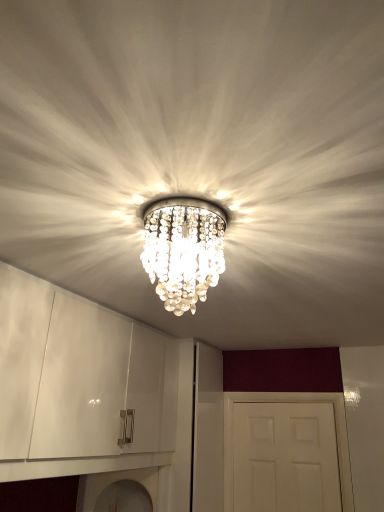
What do you see at coordinates (183, 249) in the screenshot? I see `clear crystal chandelier at center` at bounding box center [183, 249].

Find the location of `clear crystal chandelier at center`. clear crystal chandelier at center is located at coordinates (183, 249).

Describe the element at coordinates (285, 457) in the screenshot. The height and width of the screenshot is (512, 384). I see `white matte door at center` at that location.

Measure the distance between white matte door at center and camera.

white matte door at center and camera are 8.21 feet apart.

At what (x,y) coordinates should I click in order to perform the action: click on white matte door at center. Please return your answer as a coordinate pair (x, y). The width and height of the screenshot is (384, 512). Looking at the image, I should click on (285, 457).

The image size is (384, 512). I want to click on clear crystal chandelier at center, so click(x=183, y=249).

Is clear crystal chandelier at center to the right of white matte door at center from the viewer's perspective?

In fact, clear crystal chandelier at center is to the left of white matte door at center.

In the scene shown: Is clear crystal chandelier at center in front of or behind white matte door at center in the image?

In the image, clear crystal chandelier at center appears in front of white matte door at center.

Considering the points (154, 269) and (286, 412), which point is in front, point (154, 269) or point (286, 412)?

The point (154, 269) is closer.

From the image's perspective, between clear crystal chandelier at center and white matte door at center, who is located below?

From the image's view, white matte door at center is below.

From a real-world perspective, is clear crystal chandelier at center positioned under white matte door at center based on gravity?

No.

Looking at their sizes, would you say clear crystal chandelier at center is wider or thinner than white matte door at center?

Clearly, clear crystal chandelier at center has more width compared to white matte door at center.

Can you confirm if clear crystal chandelier at center is shorter than white matte door at center?

Yes, clear crystal chandelier at center is shorter than white matte door at center.

In the scene shown: Which of these two, clear crystal chandelier at center or white matte door at center, is bigger?

With larger size is white matte door at center.

Is white matte door at center inside clear crystal chandelier at center?

No, white matte door at center is not a part of clear crystal chandelier at center.

Does clear crystal chandelier at center touch white matte door at center?

No, clear crystal chandelier at center is not with white matte door at center.

Is clear crystal chandelier at center turned away from white matte door at center?

That's not correct — clear crystal chandelier at center is not looking away from white matte door at center.

How many degrees apart are the facing directions of clear crystal chandelier at center and white matte door at center?

The angle between the facing direction of clear crystal chandelier at center and the facing direction of white matte door at center is 92.5 degrees.

Locate an element on the screen. This screenshot has width=384, height=512. door behind the clear crystal chandelier at center is located at coordinates (285, 457).

Considering the relative positions of white matte door at center and clear crystal chandelier at center in the image provided, is white matte door at center to the left or to the right of clear crystal chandelier at center?

white matte door at center is to the right of clear crystal chandelier at center.

Is white matte door at center in front of or behind clear crystal chandelier at center in the image?

white matte door at center is behind clear crystal chandelier at center.

Which is less distant, (x=286, y=451) or (x=208, y=280)?

Clearly, point (x=286, y=451) is more distant from the camera than point (x=208, y=280).

From the image's perspective, which is below, white matte door at center or clear crystal chandelier at center?

white matte door at center, from the image's perspective.

Looking at this image, from a real-world perspective, who is located higher, white matte door at center or clear crystal chandelier at center?

clear crystal chandelier at center, from a real-world perspective.

Which of these two, white matte door at center or clear crystal chandelier at center, is thinner?

Thinner between the two is white matte door at center.

From their relative heights in the image, would you say white matte door at center is taller or shorter than clear crystal chandelier at center?

Considering their sizes, white matte door at center has more height than clear crystal chandelier at center.

Considering the relative sizes of white matte door at center and clear crystal chandelier at center in the image provided, is white matte door at center bigger than clear crystal chandelier at center?

Correct, white matte door at center is larger in size than clear crystal chandelier at center.

Can we say white matte door at center lies outside clear crystal chandelier at center?

white matte door at center lies outside clear crystal chandelier at center's area.

Would you consider white matte door at center to be distant from clear crystal chandelier at center?

Indeed, white matte door at center is not near clear crystal chandelier at center.

Is white matte door at center positioned with its back to clear crystal chandelier at center?

That's not correct — white matte door at center is not looking away from clear crystal chandelier at center.

How many degrees apart are the facing directions of white matte door at center and clear crystal chandelier at center?

92.5 degrees separate the facing orientations of white matte door at center and clear crystal chandelier at center.

Locate an element on the screen. The image size is (384, 512). door to the right of clear crystal chandelier at center is located at coordinates (285, 457).

Where is `lamp above the white matte door at center (from the image's perspective)`? lamp above the white matte door at center (from the image's perspective) is located at coordinates coord(183,249).

Identify the location of lamp that is on the left side of white matte door at center. This screenshot has height=512, width=384. (183, 249).